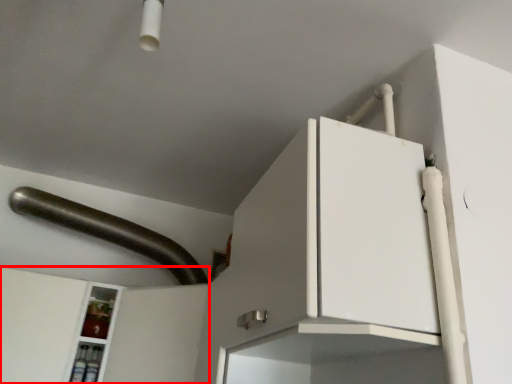
Question: From the image, what is the correct spatial relationship of cabinetry (annotated by the red box) in relation to door handle?

Choices:
 (A) right
 (B) left

Answer: (B)